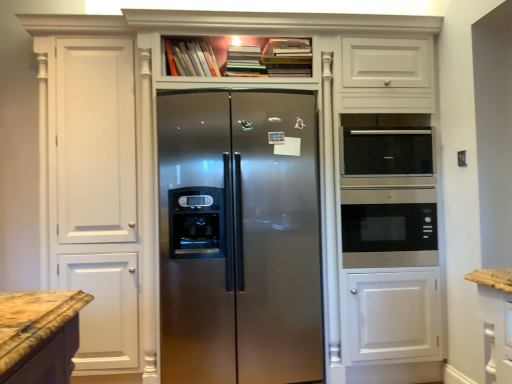
The height and width of the screenshot is (384, 512). I want to click on black glass microwave at upper right, so click(386, 151).

Locate an element on the screen. The height and width of the screenshot is (384, 512). black glass microwave at right is located at coordinates (389, 227).

Image resolution: width=512 pixels, height=384 pixels. What do you see at coordinates (245, 61) in the screenshot? I see `hardcover books at upper center, which is the 2th book from right to left` at bounding box center [245, 61].

Identify the location of hardcover books at upper center, the 3th book positioned from the left. This screenshot has width=512, height=384. (288, 57).

Is black glass microwave at right taller or shorter than hardcover books at upper center, the 3th book positioned from the left?

black glass microwave at right is taller than hardcover books at upper center, the 3th book positioned from the left.

Is black glass microwave at right completely or partially outside of hardcover books at upper center, which ranks as the first book in right-to-left order?

Yes, black glass microwave at right is outside of hardcover books at upper center, which ranks as the first book in right-to-left order.

Does black glass microwave at right appear on the left side of hardcover books at upper center, which ranks as the first book in right-to-left order?

No, black glass microwave at right is not to the left of hardcover books at upper center, which ranks as the first book in right-to-left order.

Is black glass microwave at right turned away from hardcover books at upper center, the 3th book positioned from the left?

No.

You are a GUI agent. You are given a task and a screenshot of the screen. Output one action in this format:
    pyautogui.click(x=<x>, y=<y>)
    Task: Click on the refrigerator in front of the hardcover books at upper center, which ranks as the first book in right-to-left order
    The height and width of the screenshot is (384, 512).
    Given the screenshot: What is the action you would take?
    pyautogui.click(x=239, y=237)

Is hardcover books at upper center, the 3th book positioned from the left, in front of or behind stainless steel refrigerator at center in the image?

hardcover books at upper center, the 3th book positioned from the left, is positioned farther from the viewer than stainless steel refrigerator at center.

Is stainless steel refrigerator at center inside hardcover books at upper center, which ranks as the first book in right-to-left order?

That's incorrect, stainless steel refrigerator at center is not inside hardcover books at upper center, which ranks as the first book in right-to-left order.

Is there a large distance between hardcover books at upper center, which ranks as the first book in right-to-left order, and stainless steel refrigerator at center?

Actually, hardcover books at upper center, which ranks as the first book in right-to-left order, and stainless steel refrigerator at center are a little close together.

Looking at their sizes, would you say hardcover book at upper center, which is counted as the 3th book, starting from the right, is wider or thinner than hardcover books at upper center, which is the 2th book from right to left?

hardcover book at upper center, which is counted as the 3th book, starting from the right, is thinner than hardcover books at upper center, which is the 2th book from right to left.

Is hardcover book at upper center, which is counted as the 3th book, starting from the right, positioned with its back to hardcover books at upper center, the 2th book from the left?

No, hardcover books at upper center, the 2th book from the left, is not at the back of hardcover book at upper center, which is counted as the 3th book, starting from the right.

I want to click on the 2nd book behind the hardcover books at upper center, which is the 2th book from right to left, so click(190, 58).

Is hardcover book at upper center, which is counted as the 3th book, starting from the right, spatially inside hardcover books at upper center, which is the 2th book from right to left, or outside of it?

The correct answer is: outside.

Does black glass microwave at upper right have a smaller size compared to black glass microwave at right?

Indeed, black glass microwave at upper right has a smaller size compared to black glass microwave at right.

From the image's perspective, does black glass microwave at upper right appear lower than black glass microwave at right?

Actually, black glass microwave at upper right appears above black glass microwave at right in the image.

Are black glass microwave at upper right and black glass microwave at right far apart?

Actually, black glass microwave at upper right and black glass microwave at right are a little close together.

Considering the sizes of objects hardcover books at upper center, which ranks as the first book in right-to-left order, and hardcover books at upper center, which is the 2th book from right to left, in the image provided, who is thinner, hardcover books at upper center, which ranks as the first book in right-to-left order, or hardcover books at upper center, which is the 2th book from right to left,?

With smaller width is hardcover books at upper center, which is the 2th book from right to left.

Looking at this image, from a real-world perspective, which object rests below the other?

hardcover books at upper center, which is the 2th book from right to left.

From the image's perspective, is hardcover books at upper center, which ranks as the first book in right-to-left order, located above or below hardcover books at upper center, which is the 2th book from right to left?

hardcover books at upper center, which ranks as the first book in right-to-left order, is situated higher than hardcover books at upper center, which is the 2th book from right to left, in the image.

Is hardcover books at upper center, the 3th book positioned from the left, shorter than hardcover books at upper center, the 2th book from the left?

Incorrect, the height of hardcover books at upper center, the 3th book positioned from the left, does not fall short of that of hardcover books at upper center, the 2th book from the left.

Is hardcover books at upper center, the 3th book positioned from the left, to the left or to the right of hardcover book at upper center, which is counted as the 3th book, starting from the right, in the image?

In the image, hardcover books at upper center, the 3th book positioned from the left, appears on the right side of hardcover book at upper center, which is counted as the 3th book, starting from the right.

I want to click on book that is the 2nd one when counting rightward from the hardcover book at upper center, which is counted as the 3th book, starting from the right, so click(288, 57).

Is hardcover books at upper center, the 3th book positioned from the left, far away from hardcover book at upper center, acting as the first book starting from the left?

No, hardcover books at upper center, the 3th book positioned from the left, is not far from hardcover book at upper center, acting as the first book starting from the left.

Can you confirm if hardcover books at upper center, which ranks as the first book in right-to-left order, is smaller than hardcover book at upper center, which is counted as the 3th book, starting from the right?

Actually, hardcover books at upper center, which ranks as the first book in right-to-left order, might be larger than hardcover book at upper center, which is counted as the 3th book, starting from the right.

Looking at this image, is black glass microwave at upper right oriented away from hardcover books at upper center, which ranks as the first book in right-to-left order?

No.

Does black glass microwave at upper right appear on the left side of hardcover books at upper center, the 3th book positioned from the left?

No, black glass microwave at upper right is not to the left of hardcover books at upper center, the 3th book positioned from the left.

Considering the relative sizes of black glass microwave at upper right and hardcover books at upper center, which ranks as the first book in right-to-left order, in the image provided, is black glass microwave at upper right wider than hardcover books at upper center, which ranks as the first book in right-to-left order,?

In fact, black glass microwave at upper right might be narrower than hardcover books at upper center, which ranks as the first book in right-to-left order.

Where is `the 1st book counting from the left of the black glass microwave at right`? Image resolution: width=512 pixels, height=384 pixels. the 1st book counting from the left of the black glass microwave at right is located at coordinates (288, 57).

At what (x,y) coordinates should I click in order to perform the action: click on refrigerator below the hardcover books at upper center, which ranks as the first book in right-to-left order (from a real-world perspective). Please return your answer as a coordinate pair (x, y). The image size is (512, 384). Looking at the image, I should click on (239, 237).

Which object lies nearer to the anchor point hardcover books at upper center, the 3th book positioned from the left, black glass microwave at upper right or hardcover book at upper center, which is counted as the 3th book, starting from the right?

hardcover book at upper center, which is counted as the 3th book, starting from the right, lies closer to hardcover books at upper center, the 3th book positioned from the left, than the other object.

Based on their spatial positions, is hardcover books at upper center, which is the 2th book from right to left, or hardcover book at upper center, acting as the first book starting from the left, further from black glass microwave at right?

hardcover book at upper center, acting as the first book starting from the left, is further to black glass microwave at right.

From the image, which object appears to be farther from hardcover books at upper center, the 3th book positioned from the left, hardcover books at upper center, which is the 2th book from right to left, or black glass microwave at upper right?

black glass microwave at upper right.

Looking at the image, which one is located further to hardcover books at upper center, the 3th book positioned from the left, stainless steel refrigerator at center or hardcover books at upper center, the 2th book from the left?

stainless steel refrigerator at center is further to hardcover books at upper center, the 3th book positioned from the left.

From the image, which object appears to be nearer to black glass microwave at right, hardcover book at upper center, acting as the first book starting from the left, or hardcover books at upper center, which is the 2th book from right to left?

hardcover books at upper center, which is the 2th book from right to left.

From the image, which object appears to be farther from black glass microwave at right, hardcover books at upper center, which ranks as the first book in right-to-left order, or hardcover books at upper center, which is the 2th book from right to left?

The object further to black glass microwave at right is hardcover books at upper center, which is the 2th book from right to left.

From the image, which object appears to be nearer to hardcover books at upper center, the 3th book positioned from the left, hardcover book at upper center, acting as the first book starting from the left, or hardcover books at upper center, which is the 2th book from right to left?

hardcover books at upper center, which is the 2th book from right to left.

From the image, which object appears to be nearer to stainless steel refrigerator at center, hardcover books at upper center, the 2th book from the left, or hardcover book at upper center, acting as the first book starting from the left?

Based on the image, hardcover book at upper center, acting as the first book starting from the left, appears to be nearer to stainless steel refrigerator at center.

The height and width of the screenshot is (384, 512). I want to click on appliance between hardcover books at upper center, the 2th book from the left, and black glass microwave at right, in the vertical direction, so click(386, 151).

This screenshot has width=512, height=384. I want to click on microwave oven that lies between hardcover books at upper center, which is the 2th book from right to left, and stainless steel refrigerator at center from top to bottom, so click(x=389, y=227).

In order to click on appliance between hardcover books at upper center, the 2th book from the left, and stainless steel refrigerator at center, in the vertical direction in this screenshot , I will do coord(386,151).

Find the location of a particular element. This screenshot has width=512, height=384. microwave oven that lies between hardcover books at upper center, the 3th book positioned from the left, and stainless steel refrigerator at center from top to bottom is located at coordinates (389, 227).